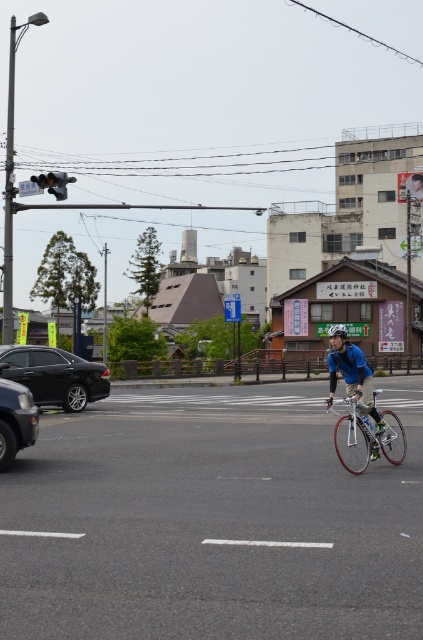
Is shiny black sedan at left wider than white matte bicycle helmet at center?

No, shiny black sedan at left is not wider than white matte bicycle helmet at center.

Between shiny black sedan at left and white matte bicycle helmet at center, which one appears on the right side from the viewer's perspective?

From the viewer's perspective, white matte bicycle helmet at center appears more on the right side.

Between point (13, 353) and point (329, 330), which one is positioned behind?

Positioned behind is point (13, 353).

Identify the location of shiny black sedan at left. The height and width of the screenshot is (640, 423). (54, 376).

Is point (55, 193) positioned in front of point (343, 328)?

That is False.

Who is more distant from viewer, (x=38, y=182) or (x=340, y=337)?

Point (x=38, y=182)

Identify the location of metallic traffic light at upper left. (54, 182).

Is shiny black sedan at left above shiny black car at left?

Yes.

Is shiny black sedan at left taller than shiny black car at left?

Correct, shiny black sedan at left is much taller as shiny black car at left.

Between point (19, 352) and point (16, 422), which one is positioned in front?

Point (16, 422) is more forward.

This screenshot has height=640, width=423. What are the coordinates of `shiny black sedan at left` in the screenshot? It's located at (54, 376).